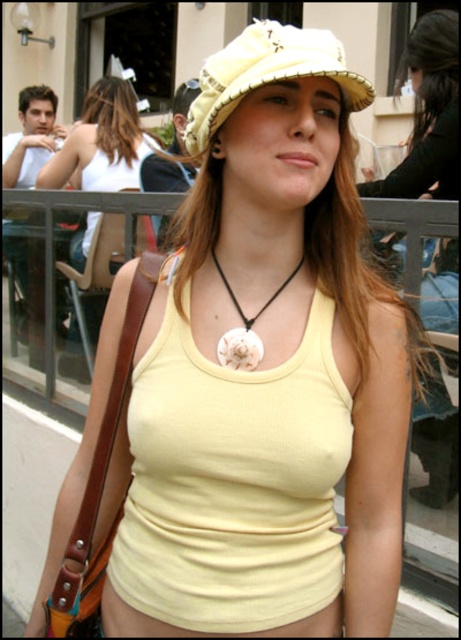
Question: Can you confirm if matte yellow tank top at center is positioned to the right of white shell necklace at center?

Choices:
 (A) no
 (B) yes

Answer: (A)

Question: From the image, what is the correct spatial relationship of matte yellow tank top at center in relation to white shell necklace at center?

Choices:
 (A) above
 (B) below

Answer: (A)

Question: Which of the following is the closest to the observer?

Choices:
 (A) beige straw hat at center
 (B) white shell necklace at center

Answer: (A)

Question: Is beige straw hat at center closer to camera compared to white shell necklace at center?

Choices:
 (A) yes
 (B) no

Answer: (A)

Question: Which object is the farthest from the beige straw hat at center?

Choices:
 (A) matte yellow tank top at center
 (B) white shell necklace at center

Answer: (A)

Question: Considering the real-world distances, which object is closest to the beige straw hat at center?

Choices:
 (A) matte yellow tank top at center
 (B) white shell necklace at center

Answer: (B)